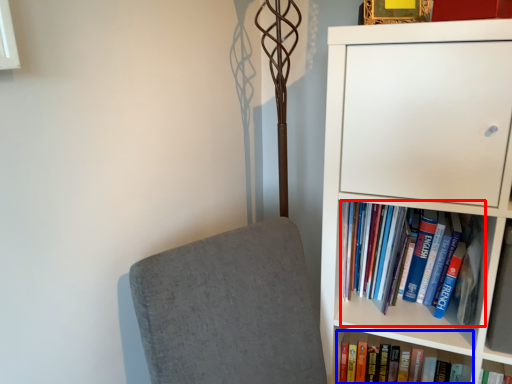
Question: Which point is further to the camera, book (highlighted by a red box) or book (highlighted by a blue box)?

Choices:
 (A) book
 (B) book

Answer: (B)